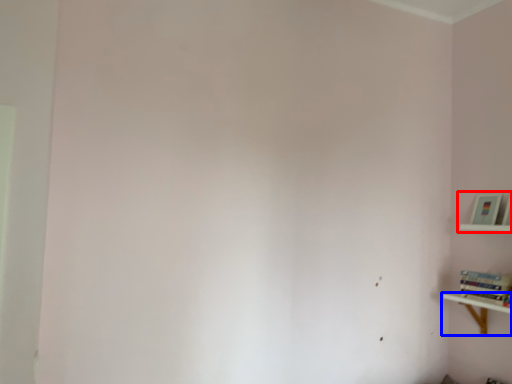
Question: Which object appears closest to the camera in this image, shelf (highlighted by a red box) or shelf (highlighted by a blue box)?

Choices:
 (A) shelf
 (B) shelf

Answer: (B)